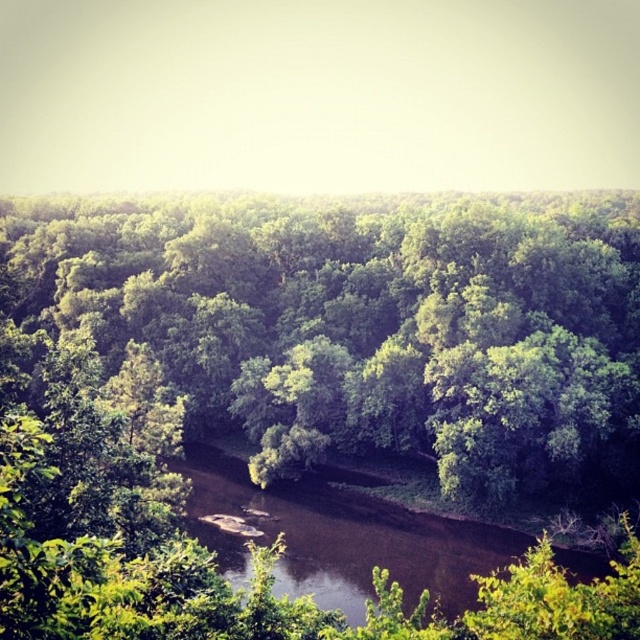
What do you see at coordinates (308, 396) in the screenshot? I see `green leafy forest at center` at bounding box center [308, 396].

Is point (349, 356) farther from camera compared to point (397, 508)?

Yes, point (349, 356) is behind point (397, 508).

Who is more distant from viewer, (264, 285) or (202, 524)?

Point (264, 285)

Where is `green leafy forest at center`? The image size is (640, 640). green leafy forest at center is located at coordinates (308, 396).